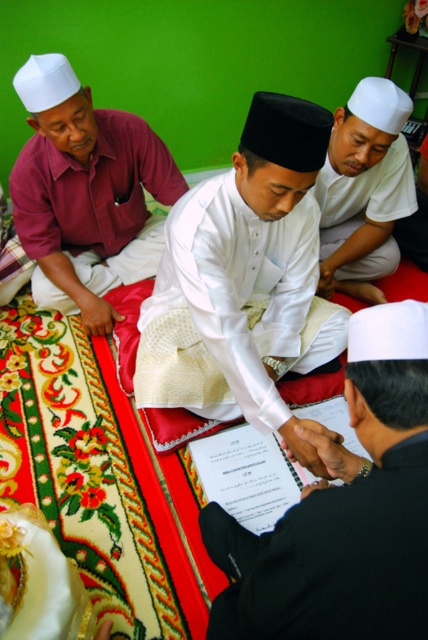
In the image, there are several people involved in a ceremony. The central figure is wearing a white traditional outfit with a black cap. To his right is someone in a white outfit and white cap, and on the left side of the frame, there is a black satin robe at lower right represented by point (330, 561). If you were standing in front of the image, which direction would the black satin robe at lower right be relative to the central figure?

The black satin robe at lower right is located to the right side of the central figure.

You are attending this ceremony and need to hand a document to the person wearing the white matte shirt at center. Since the matte maroon shirt at left is blocking the way, can you still reach them without moving the person?

The matte maroon shirt at left is positioned over white matte shirt at center, meaning the person in the matte maroon shirt is directly in front of them. You would need to move around or go behind the person in the matte maroon shirt to reach the white matte shirt at center.

You are an event planner arranging seating for a ceremony. You have two items to place on the stage according to their sizes. The black satin robe at lower right and the matte maroon shirt at left. Which item should be placed on the smaller designated spot?

The black satin robe at lower right should be placed on the smaller designated spot because it is smaller than the matte maroon shirt at left.